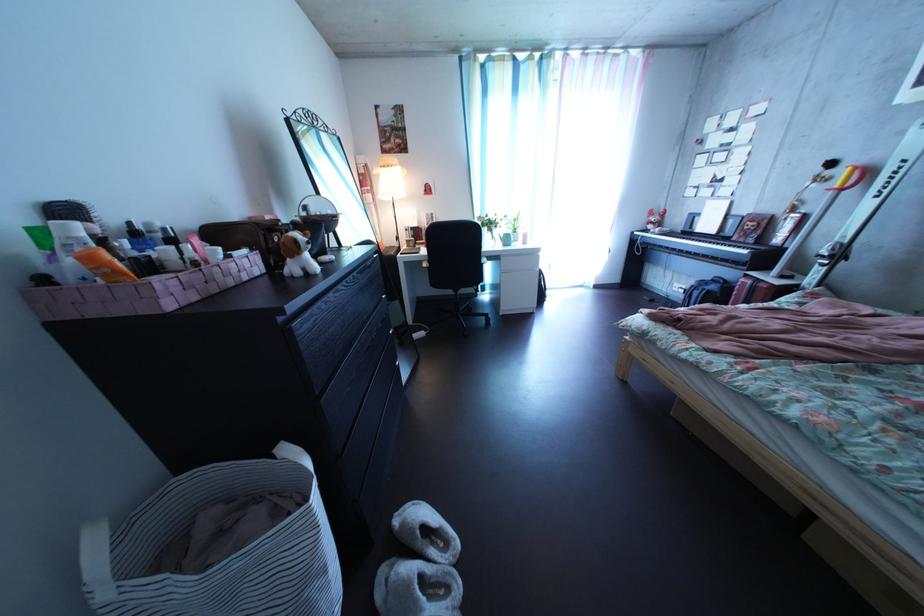
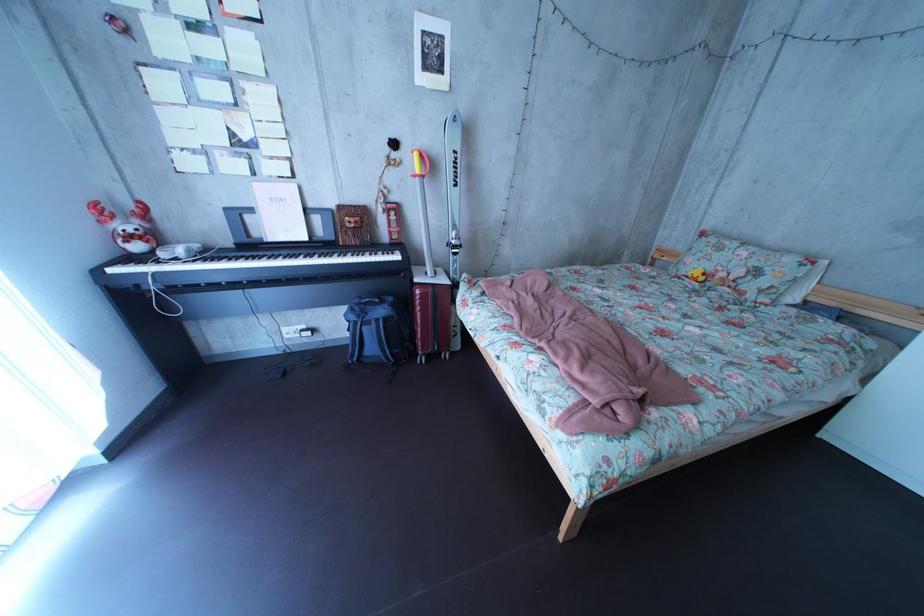
In the second image, find the point that corresponds to [727,294] in the first image.

(395, 320)